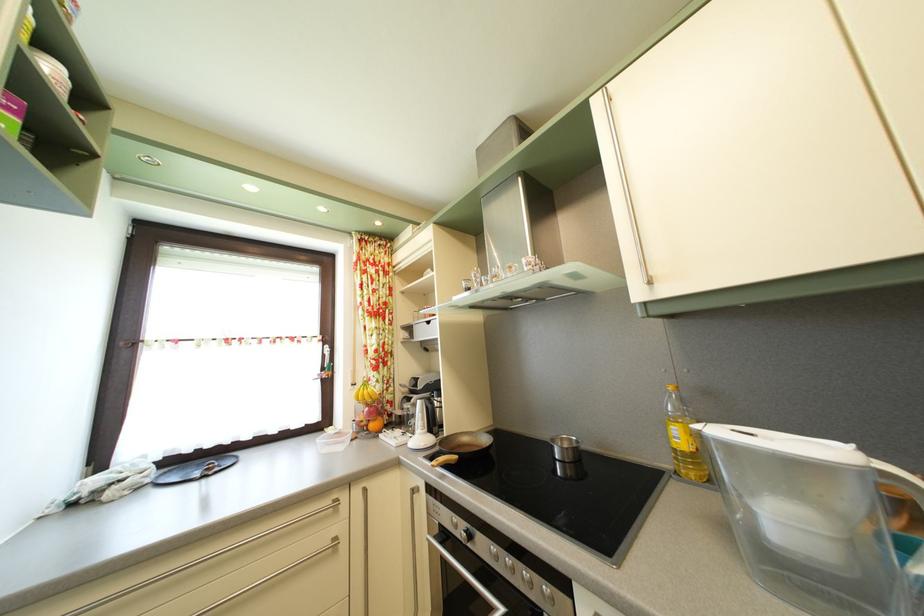
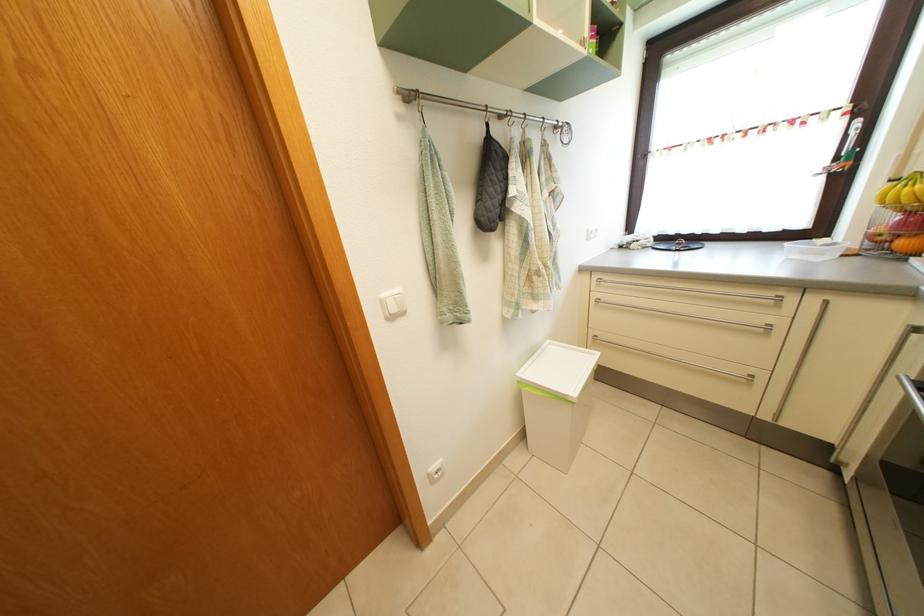
Locate, in the second image, the point that corresponds to the point at 332,363 in the first image.

(853, 146)